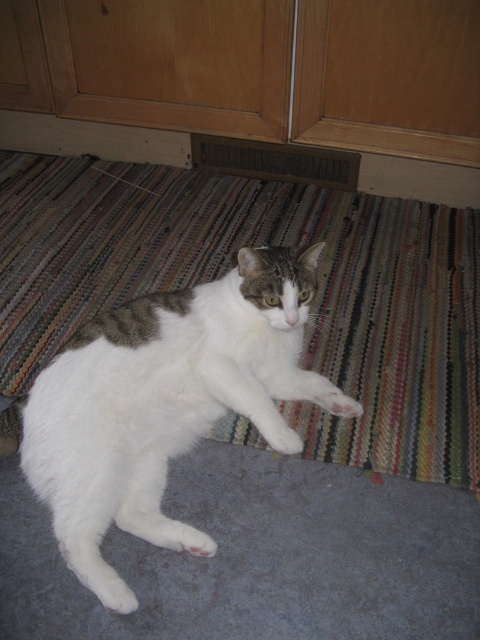
You are trying to place a small toy on the floor where the striped carpet at lower center and white fur cat at center are. Which object should you place the toy on to ensure it is more likely to stay on the surface without falling off?

The striped carpet at lower center has a larger size compared to the white fur cat at center, so placing the toy on the striped carpet at lower center would provide a more stable and larger surface area, reducing the chance of it falling off.